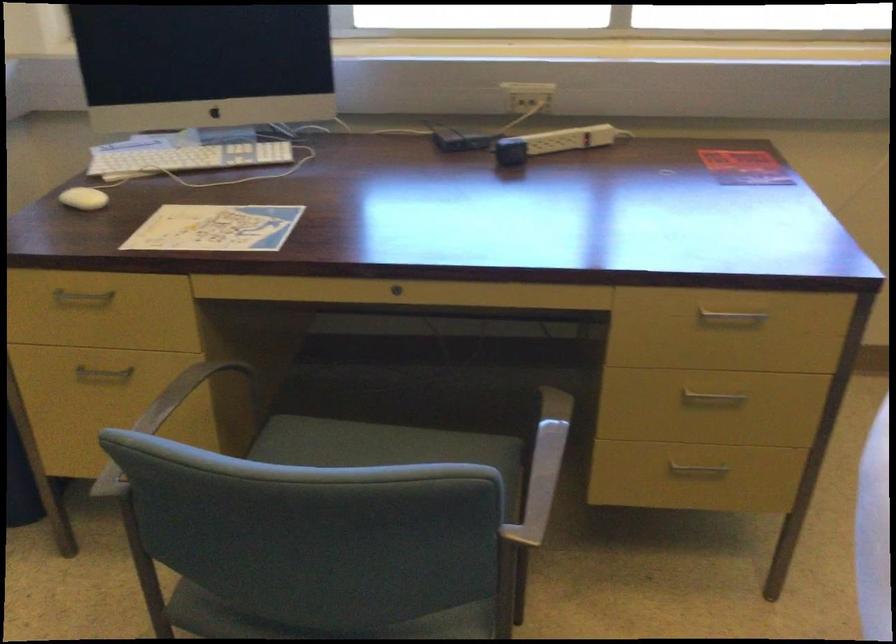
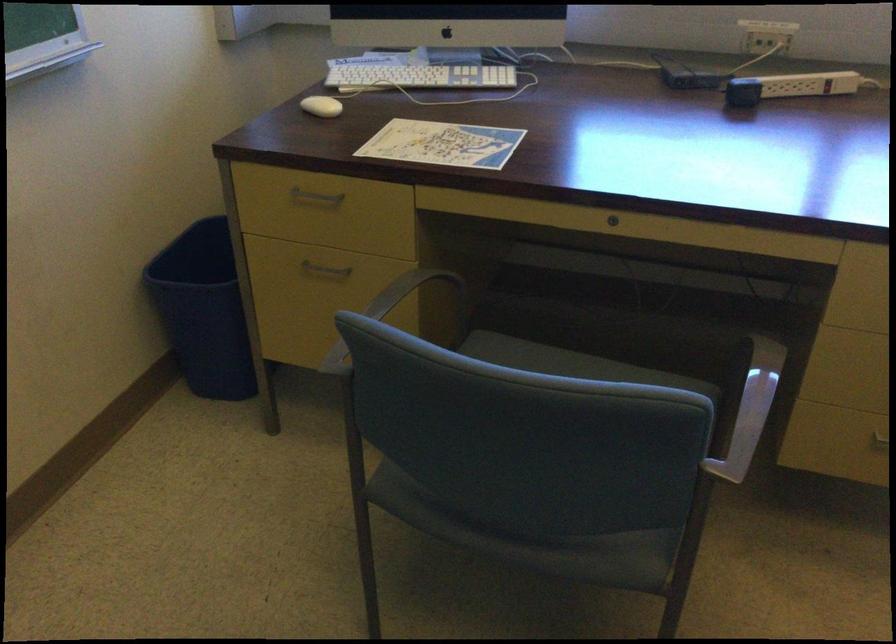
Where in the second image is the point corresponding to the point at 188,406 from the first image?

(393, 308)